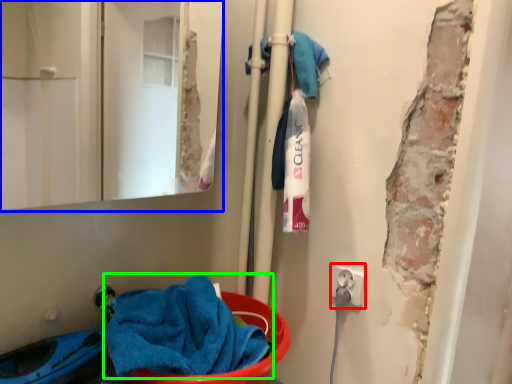
Question: Based on their relative distances, which object is nearer to electric outlet (highlighted by a red box)? Choose from mirror (highlighted by a blue box) and towel (highlighted by a green box).

Choices:
 (A) mirror
 (B) towel

Answer: (B)